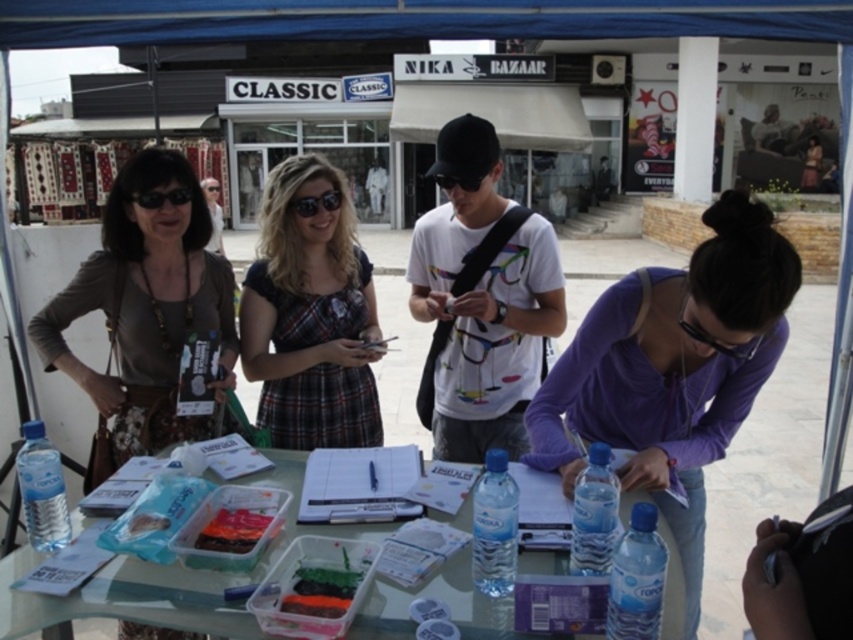
Can you confirm if purple zip-up jacket at center is shorter than translucent plastic water bottle at center?

No, purple zip-up jacket at center is not shorter than translucent plastic water bottle at center.

Who is taller, purple zip-up jacket at center or translucent plastic water bottle at center?

purple zip-up jacket at center is taller.

Is point (676, 538) positioned after point (490, 488)?

Yes, point (676, 538) is behind point (490, 488).

Where is `purple zip-up jacket at center`? The image size is (853, 640). purple zip-up jacket at center is located at coordinates coord(672,371).

Which of these two, plaid fabric dress at center or black plastic sunglasses at center, stands shorter?

black plastic sunglasses at center is shorter.

Is point (251, 276) positioned in front of point (328, 189)?

That is False.

Image resolution: width=853 pixels, height=640 pixels. I want to click on plaid fabric dress at center, so click(x=310, y=316).

Is purple zip-up jacket at center to the left of transparent plastic goggles at lower right from the viewer's perspective?

Correct, you'll find purple zip-up jacket at center to the left of transparent plastic goggles at lower right.

Who is taller, purple zip-up jacket at center or transparent plastic goggles at lower right?

purple zip-up jacket at center

You are a GUI agent. You are given a task and a screenshot of the screen. Output one action in this format:
    pyautogui.click(x=<x>, y=<y>)
    Task: Click on the purple zip-up jacket at center
    
    Given the screenshot: What is the action you would take?
    pyautogui.click(x=672, y=371)